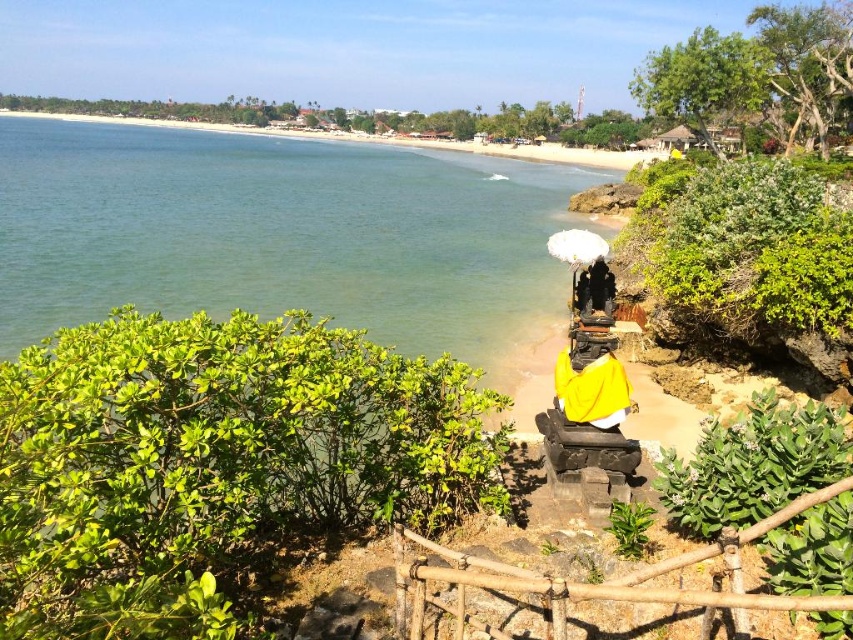
Question: Does green water at lower left have a smaller size compared to yellow draped statue at center?

Choices:
 (A) yes
 (B) no

Answer: (B)

Question: Can you confirm if brown bamboo fence at center is thinner than yellow draped statue at center?

Choices:
 (A) no
 (B) yes

Answer: (A)

Question: Which point appears farthest from the camera in this image?

Choices:
 (A) (389, 266)
 (B) (825, 596)
 (C) (583, 394)

Answer: (A)

Question: Which point is farther to the camera?

Choices:
 (A) click(550, 582)
 (B) click(169, 196)

Answer: (B)

Question: Considering the relative positions of green water at lower left and brown bamboo fence at center in the image provided, where is green water at lower left located with respect to brown bamboo fence at center?

Choices:
 (A) right
 (B) left

Answer: (B)

Question: Which object is closer to the camera taking this photo?

Choices:
 (A) brown bamboo fence at center
 (B) green water at lower left
 (C) yellow draped statue at center

Answer: (A)